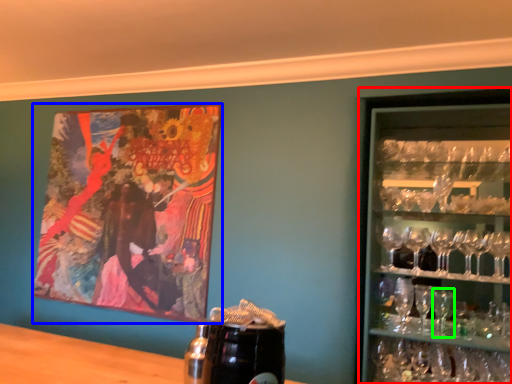
Question: Which object is the farthest from shelf (highlighted by a red box)? Choose among these: picture frame (highlighted by a blue box) or martini glass (highlighted by a green box).

Choices:
 (A) picture frame
 (B) martini glass

Answer: (A)